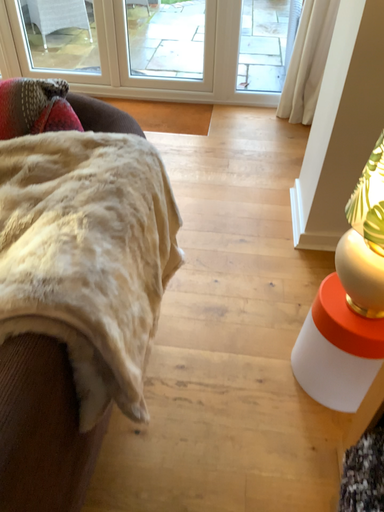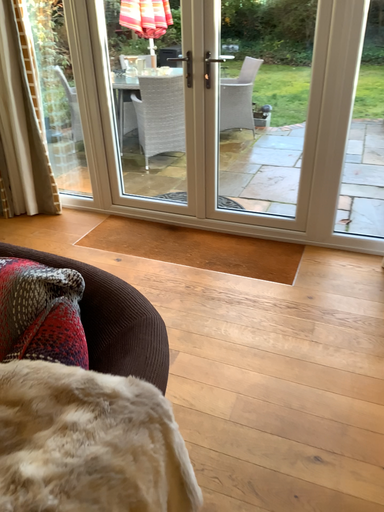
Question: Which way did the camera rotate in the video?

Choices:
 (A) rotated upward
 (B) rotated downward

Answer: (A)